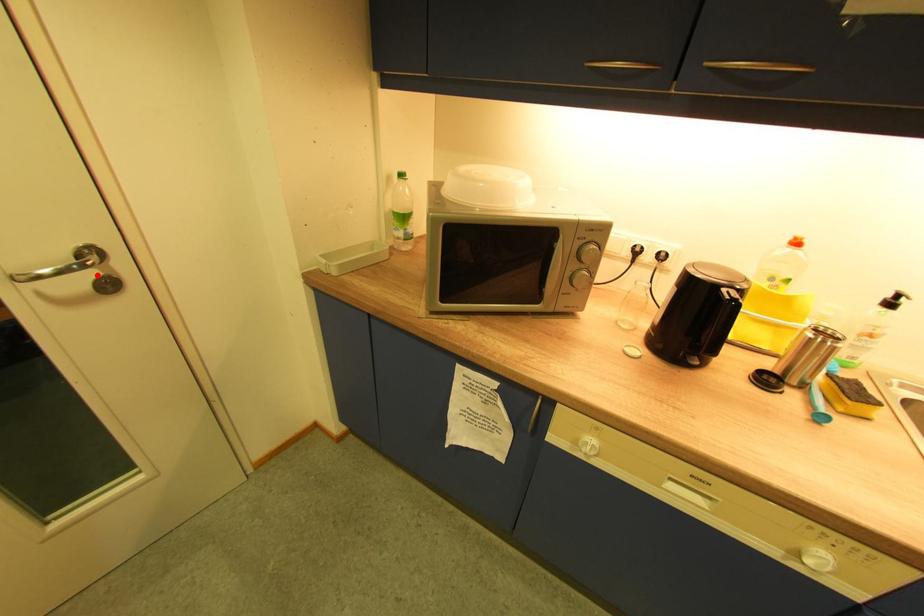
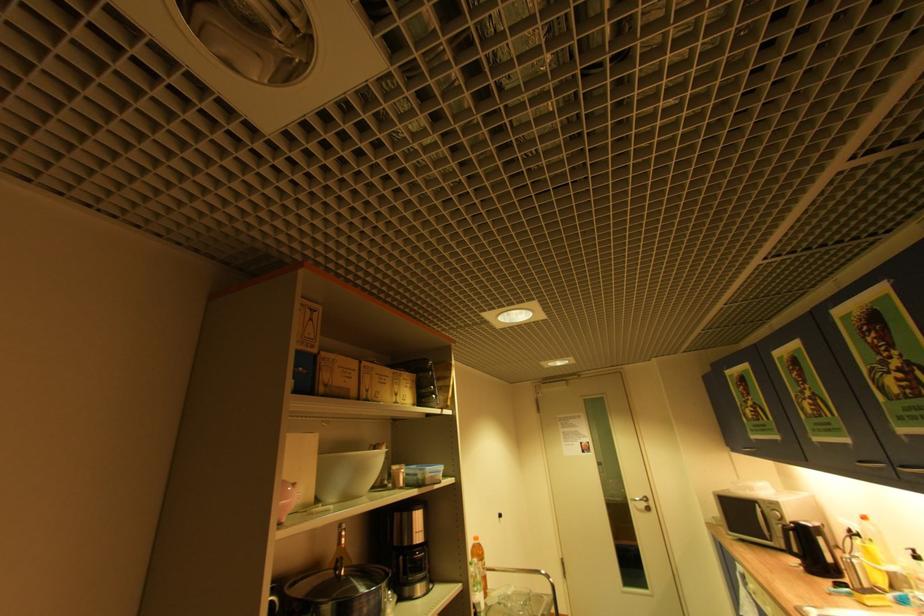
Where in the second image is the point corresponding to the highlighted location from the first image?

(650, 505)